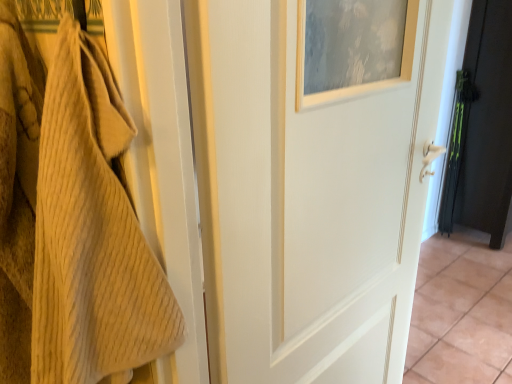
Question: Based on their sizes in the image, would you say black matte door at right, which is counted as the 2th door, starting from the left, is bigger or smaller than white painted wood door at center, the second door positioned from the back?

Choices:
 (A) small
 (B) big

Answer: (B)

Question: Considering the positions of point (468, 44) and point (359, 233), is point (468, 44) closer or farther from the camera than point (359, 233)?

Choices:
 (A) closer
 (B) farther

Answer: (B)

Question: Estimate the real-world distances between objects in this image. Which object is farther from the white painted wood door at center, the 2th door in the right-to-left sequence?

Choices:
 (A) black matte door at right, arranged as the first door when viewed from the right
 (B) beige textured towel at left
 (C) white glossy tile at center

Answer: (A)

Question: Which object is the farthest from the white painted wood door at center, the second door positioned from the back?

Choices:
 (A) black matte door at right, the first door when ordered from back to front
 (B) white glossy tile at center
 (C) beige textured towel at left

Answer: (A)